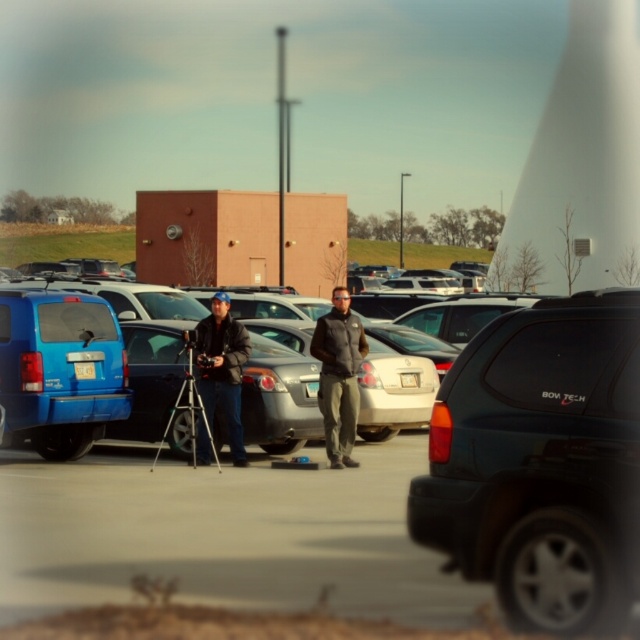
In the scene shown: Who is shorter, metallic silver car at center or blue matte van at center?

Standing shorter between the two is metallic silver car at center.

Which is behind, point (125, 564) or point (198, 307)?

Positioned behind is point (198, 307).

Where is `metallic silver car at center`? metallic silver car at center is located at coordinates (221, 532).

Which is below, metallic silver car at center or dark gray fleece jacket at center?

metallic silver car at center is below.

Can you confirm if metallic silver car at center is taller than dark gray fleece jacket at center?

No.

Identify the location of metallic silver car at center. (221, 532).

Is matte blue van at left positioned before dark gray fleece jacket at center?

That is True.

Between matte blue van at left and dark gray fleece jacket at center, which one is positioned higher?

dark gray fleece jacket at center is above.

What do you see at coordinates (60, 369) in the screenshot? The height and width of the screenshot is (640, 640). I see `matte blue van at left` at bounding box center [60, 369].

The height and width of the screenshot is (640, 640). I want to click on matte blue van at left, so click(60, 369).